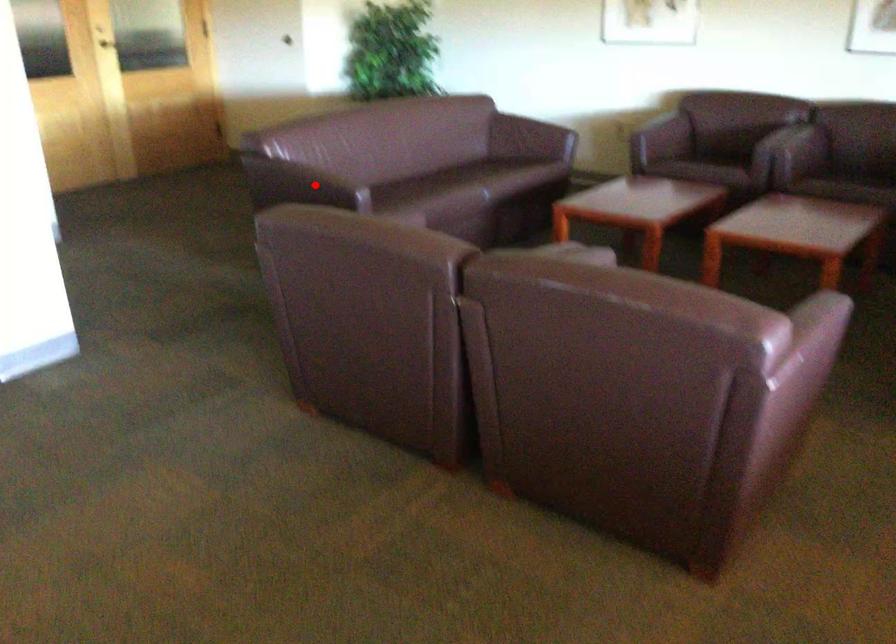
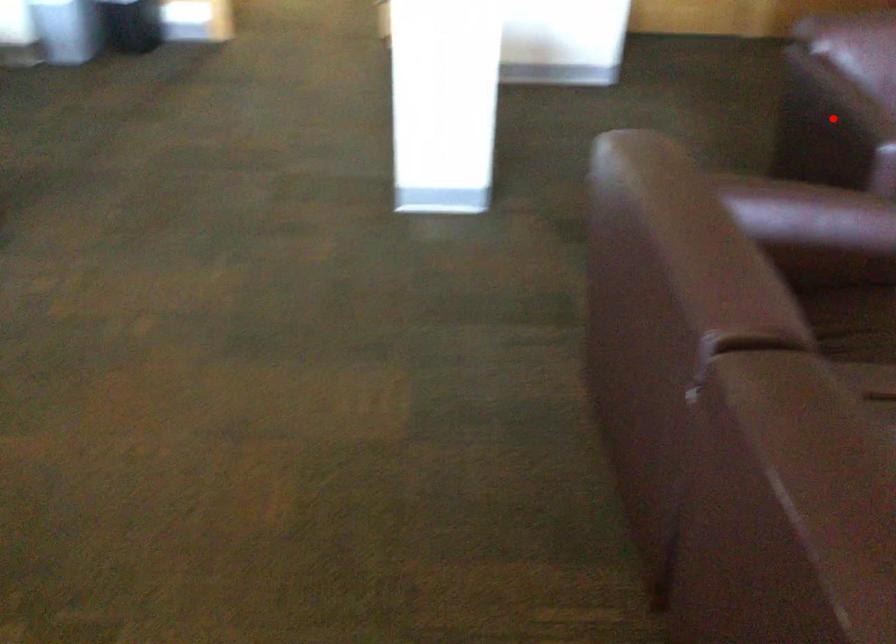
I am providing you with two images of the same scene from different viewpoints. A red point is marked on the first image and another point is marked on the second image. Is the marked point in image1 the same physical position as the marked point in image2?

Yes